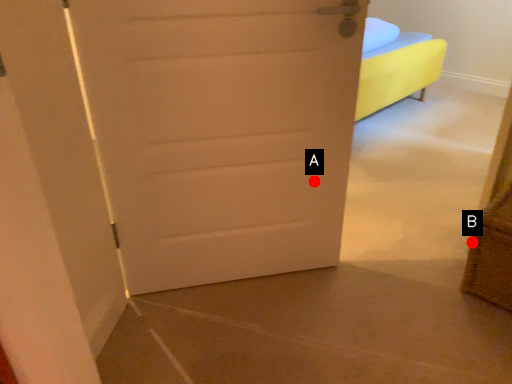
Question: Two points are circled on the image, labeled by A and B beside each circle. Which point is closer to the camera taking this photo?

Choices:
 (A) A is closer
 (B) B is closer

Answer: (A)